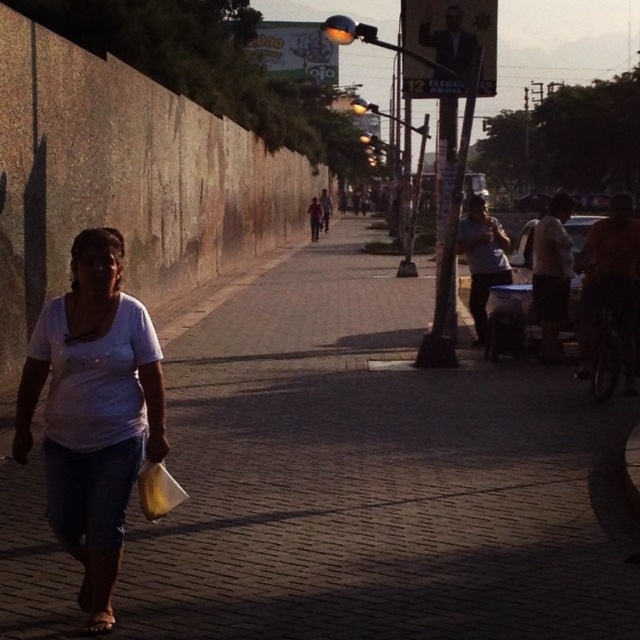
Who is positioned more to the right, brick pavement at center or white matte shirt at center?

brick pavement at center

Which is behind, point (362, 595) or point (56, 449)?

Positioned behind is point (362, 595).

At what (x,y) coordinates should I click in order to perform the action: click on brick pavement at center. Please return your answer as a coordinate pair (x, y). The width and height of the screenshot is (640, 640). Looking at the image, I should click on (376, 477).